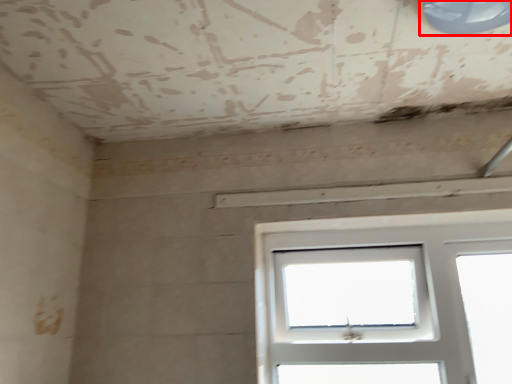
Question: From the image's perspective, what is the correct spatial relationship of window (annotated by the red box) in relation to window?

Choices:
 (A) above
 (B) below

Answer: (A)